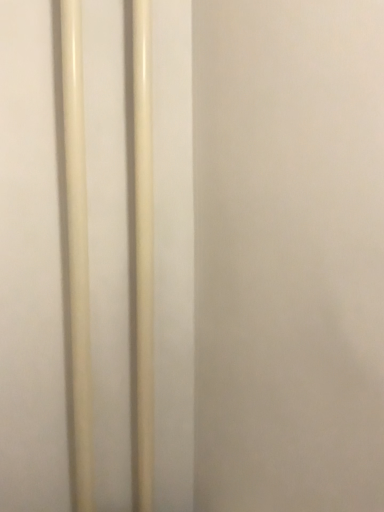
Image resolution: width=384 pixels, height=512 pixels. Describe the element at coordinates (143, 256) in the screenshot. I see `matte plastic pole at center, which appears as the 1th pole when viewed from the right` at that location.

The image size is (384, 512). What are the coordinates of `matte plastic pole at center, arranged as the 2th pole when viewed from the left` in the screenshot? It's located at (143, 256).

Measure the distance between matte white pole at left, the 2th pole from the right, and camera.

They are 35.11 inches apart.

This screenshot has height=512, width=384. Describe the element at coordinates (77, 251) in the screenshot. I see `matte white pole at left, the 2th pole from the right` at that location.

Locate an element on the screen. The width and height of the screenshot is (384, 512). matte white pole at left, the 2th pole from the right is located at coordinates (77, 251).

At what (x,y) coordinates should I click in order to perform the action: click on matte plastic pole at center, arranged as the 2th pole when viewed from the left. Please return your answer as a coordinate pair (x, y). The height and width of the screenshot is (512, 384). Looking at the image, I should click on (143, 256).

Is matte white pole at left, acting as the first pole starting from the left, to the right of matte plastic pole at center, arranged as the 2th pole when viewed from the left, from the viewer's perspective?

No.

Which object is closer to the camera, matte white pole at left, acting as the first pole starting from the left, or matte plastic pole at center, arranged as the 2th pole when viewed from the left?

matte white pole at left, acting as the first pole starting from the left, is more forward.

Is point (67, 196) farther from viewer compared to point (151, 130)?

No, it is in front of (151, 130).

From the image's perspective, is matte white pole at left, acting as the first pole starting from the left, under matte plastic pole at center, which appears as the 1th pole when viewed from the right?

Yes, from the image's perspective, matte white pole at left, acting as the first pole starting from the left, is below matte plastic pole at center, which appears as the 1th pole when viewed from the right.

From a real-world perspective, does matte white pole at left, acting as the first pole starting from the left, stand above matte plastic pole at center, which appears as the 1th pole when viewed from the right?

Indeed, from a real-world perspective, matte white pole at left, acting as the first pole starting from the left, stands above matte plastic pole at center, which appears as the 1th pole when viewed from the right.

Is matte white pole at left, the 2th pole from the right, wider than matte plastic pole at center, arranged as the 2th pole when viewed from the left?

Correct, the width of matte white pole at left, the 2th pole from the right, exceeds that of matte plastic pole at center, arranged as the 2th pole when viewed from the left.

Who is shorter, matte white pole at left, the 2th pole from the right, or matte plastic pole at center, arranged as the 2th pole when viewed from the left?

matte white pole at left, the 2th pole from the right.

Considering the sizes of matte white pole at left, acting as the first pole starting from the left, and matte plastic pole at center, which appears as the 1th pole when viewed from the right, in the image, is matte white pole at left, acting as the first pole starting from the left, bigger or smaller than matte plastic pole at center, which appears as the 1th pole when viewed from the right,?

matte white pole at left, acting as the first pole starting from the left, is bigger than matte plastic pole at center, which appears as the 1th pole when viewed from the right.

Is matte white pole at left, the 2th pole from the right, situated inside matte plastic pole at center, arranged as the 2th pole when viewed from the left, or outside?

matte white pole at left, the 2th pole from the right, is spatially situated outside matte plastic pole at center, arranged as the 2th pole when viewed from the left.

Would you say matte white pole at left, the 2th pole from the right, is a long distance from matte plastic pole at center, which appears as the 1th pole when viewed from the right?

No, matte white pole at left, the 2th pole from the right, is in close proximity to matte plastic pole at center, which appears as the 1th pole when viewed from the right.

Is matte white pole at left, the 2th pole from the right, turned away from matte plastic pole at center, which appears as the 1th pole when viewed from the right?

No, matte white pole at left, the 2th pole from the right, is not facing the opposite direction of matte plastic pole at center, which appears as the 1th pole when viewed from the right.

Where is `pole lying on the left of matte plastic pole at center, arranged as the 2th pole when viewed from the left`? pole lying on the left of matte plastic pole at center, arranged as the 2th pole when viewed from the left is located at coordinates (77, 251).

Does matte plastic pole at center, which appears as the 1th pole when viewed from the right, appear on the right side of matte white pole at left, the 2th pole from the right?

Indeed, matte plastic pole at center, which appears as the 1th pole when viewed from the right, is positioned on the right side of matte white pole at left, the 2th pole from the right.

Who is more distant, matte plastic pole at center, arranged as the 2th pole when viewed from the left, or matte white pole at left, acting as the first pole starting from the left?

matte plastic pole at center, arranged as the 2th pole when viewed from the left.

Between point (138, 164) and point (73, 116), which one is positioned behind?

The point (138, 164) is behind.

From the image's perspective, is matte plastic pole at center, arranged as the 2th pole when viewed from the left, above matte white pole at left, the 2th pole from the right?

Indeed, from the image's perspective, matte plastic pole at center, arranged as the 2th pole when viewed from the left, is shown above matte white pole at left, the 2th pole from the right.

From a real-world perspective, who is located lower, matte plastic pole at center, which appears as the 1th pole when viewed from the right, or matte white pole at left, the 2th pole from the right?

matte plastic pole at center, which appears as the 1th pole when viewed from the right, from a real-world perspective.

Between matte plastic pole at center, arranged as the 2th pole when viewed from the left, and matte white pole at left, the 2th pole from the right, which one has smaller width?

matte plastic pole at center, arranged as the 2th pole when viewed from the left, is thinner.

Who is taller, matte plastic pole at center, which appears as the 1th pole when viewed from the right, or matte white pole at left, acting as the first pole starting from the left?

With more height is matte plastic pole at center, which appears as the 1th pole when viewed from the right.

Does matte plastic pole at center, arranged as the 2th pole when viewed from the left, have a smaller size compared to matte white pole at left, the 2th pole from the right?

Correct, matte plastic pole at center, arranged as the 2th pole when viewed from the left, occupies less space than matte white pole at left, the 2th pole from the right.

Would you say matte plastic pole at center, which appears as the 1th pole when viewed from the right, is outside matte white pole at left, acting as the first pole starting from the left?

Yes, matte plastic pole at center, which appears as the 1th pole when viewed from the right, is outside of matte white pole at left, acting as the first pole starting from the left.

Would you consider matte plastic pole at center, which appears as the 1th pole when viewed from the right, to be distant from matte white pole at left, the 2th pole from the right?

No, matte plastic pole at center, which appears as the 1th pole when viewed from the right, is not far from matte white pole at left, the 2th pole from the right.

Could you tell me if matte plastic pole at center, which appears as the 1th pole when viewed from the right, is turned towards matte white pole at left, acting as the first pole starting from the left?

No, matte plastic pole at center, which appears as the 1th pole when viewed from the right, does not turn towards matte white pole at left, acting as the first pole starting from the left.

How different are the orientations of matte plastic pole at center, which appears as the 1th pole when viewed from the right, and matte white pole at left, the 2th pole from the right, in degrees?

The facing directions of matte plastic pole at center, which appears as the 1th pole when viewed from the right, and matte white pole at left, the 2th pole from the right, are 0.000227 degrees apart.

Measure the distance from matte plastic pole at center, arranged as the 2th pole when viewed from the left, to matte white pole at left, the 2th pole from the right.

5.38 inches.

You are a GUI agent. You are given a task and a screenshot of the screen. Output one action in this format:
    pyautogui.click(x=<x>, y=<y>)
    Task: Click on the pole that is in front of the matte plastic pole at center, which appears as the 1th pole when viewed from the right
    Image resolution: width=384 pixels, height=512 pixels.
    Given the screenshot: What is the action you would take?
    pyautogui.click(x=77, y=251)

At what (x,y) coordinates should I click in order to perform the action: click on pole on the left of matte plastic pole at center, which appears as the 1th pole when viewed from the right. Please return your answer as a coordinate pair (x, y). This screenshot has width=384, height=512. Looking at the image, I should click on (77, 251).

Find the location of a particular element. Image resolution: width=384 pixels, height=512 pixels. pole beneath the matte white pole at left, acting as the first pole starting from the left (from a real-world perspective) is located at coordinates (143, 256).